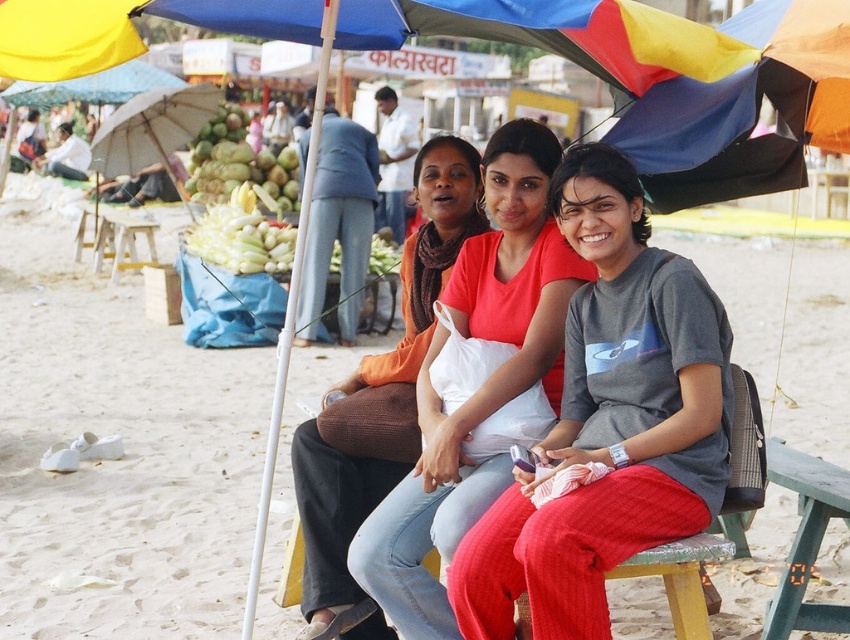
Question: Which point is farther to the camera?

Choices:
 (A) beige sand at lower center
 (B) green matte coconut at upper left
 (C) green plastic bench at lower right

Answer: (B)

Question: Which object is farther from the camera taking this photo?

Choices:
 (A) wooden stool at lower left
 (B) green plastic bench at lower right
 (C) matte orange sweater at center

Answer: (A)

Question: Is gray cotton t-shirt at center positioned in front of green plastic bench at lower right?

Choices:
 (A) no
 (B) yes

Answer: (B)

Question: Is gray cotton t-shirt at center below green matte coconut at upper left?

Choices:
 (A) no
 (B) yes

Answer: (B)

Question: Is green plastic bench at lower right below green matte coconut at upper left?

Choices:
 (A) no
 (B) yes

Answer: (B)

Question: Which is farther from the brown fabric scarf at center?

Choices:
 (A) wooden stool at lower left
 (B) yellow fabric canopy at upper left
 (C) green plastic bench at lower right

Answer: (A)